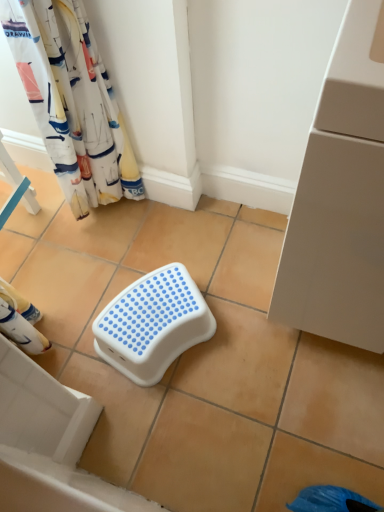
Identify the location of vacant space situated above white plastic step stool at center (from a real-world perspective). (153, 311).